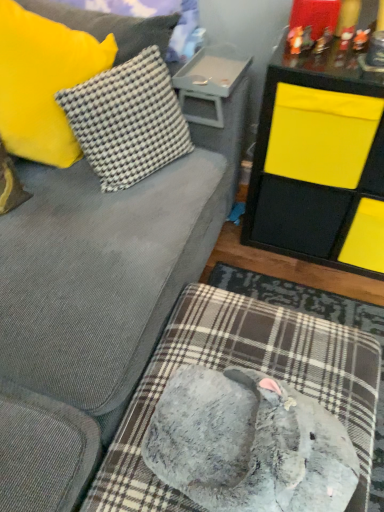
Question: In terms of width, does plastic tray at upper center, which is the second table from right to left, look wider or thinner when compared to yellow matte storage unit at upper right, which is the second table in left-to-right order?

Choices:
 (A) wide
 (B) thin

Answer: (B)

Question: Which is correct: plastic tray at upper center, which is the second table from right to left, is inside yellow matte storage unit at upper right, placed as the first table when sorted from right to left, or outside of it?

Choices:
 (A) inside
 (B) outside

Answer: (B)

Question: Which of these objects is positioned closest to the white checkered fabric pillow at upper left, the second pillow viewed from the left?

Choices:
 (A) plastic tray at upper center, positioned as the first table in left-to-right order
 (B) yellow matte storage unit at upper right, which is the second table in left-to-right order
 (C) yellow fuzzy pillow at upper left, the 2th pillow positioned from the right
 (D) gray plush dog bed at lower center

Answer: (C)

Question: Which of these objects is positioned closest to the yellow fuzzy pillow at upper left, the 1th pillow from the left?

Choices:
 (A) plastic tray at upper center, positioned as the first table in left-to-right order
 (B) gray plush dog bed at lower center
 (C) yellow matte storage unit at upper right, placed as the first table when sorted from right to left
 (D) white checkered fabric pillow at upper left, the 1th pillow positioned from the right

Answer: (D)